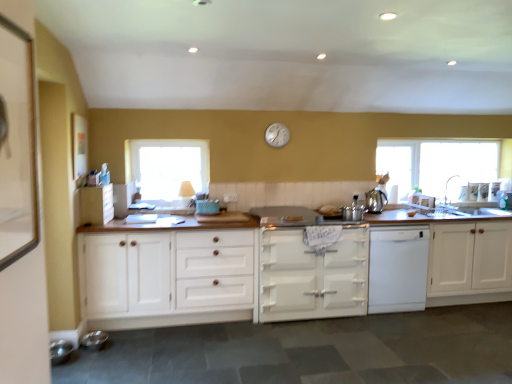
Question: From their relative heights in the image, would you say white wood cabinet at center, the third cabinetry when ordered from right to left, is taller or shorter than white plastic clock at upper center?

Choices:
 (A) short
 (B) tall

Answer: (B)

Question: Considering the relative positions of white wood cabinet at center, the third cabinetry when ordered from right to left, and white plastic clock at upper center in the image provided, is white wood cabinet at center, the third cabinetry when ordered from right to left, to the left or to the right of white plastic clock at upper center?

Choices:
 (A) right
 (B) left

Answer: (B)

Question: Estimate the real-world distances between objects in this image. Which object is closer to the white plastic clock at upper center?

Choices:
 (A) shiny metallic kettle at right
 (B) white painted wood stove at center, which is the third cabinetry from left to right
 (C) white wood cabinet at right, which is counted as the fourth cabinetry, starting from the left
 (D) white wood cabinet at left, acting as the 1th cabinetry starting from the left
 (E) transparent glass window at right, which appears as the first window when viewed from the back

Answer: (A)

Question: Estimate the real-world distances between objects in this image. Which object is farther from the white enamel gas stove at center?

Choices:
 (A) white wood cabinet at right, which is counted as the fourth cabinetry, starting from the left
 (B) transparent glass window at center, acting as the second window starting from the right
 (C) metallic silver bowl at lower left, which is counted as the 2th appliance, starting from the top
 (D) transparent glass window at right, the second window in the left-to-right sequence
 (E) metallic silver pots at center, placed as the third appliance when sorted from front to back

Answer: (C)